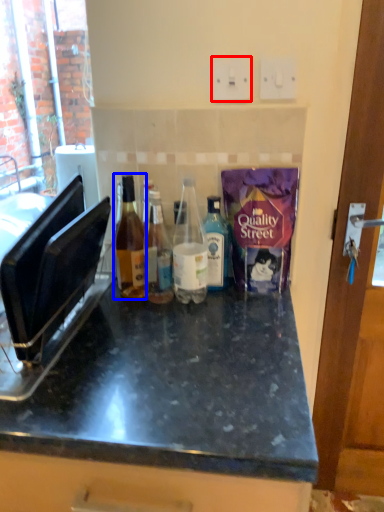
Question: Which object is further to the camera taking this photo, electric outlet (highlighted by a red box) or bottle (highlighted by a blue box)?

Choices:
 (A) electric outlet
 (B) bottle

Answer: (A)